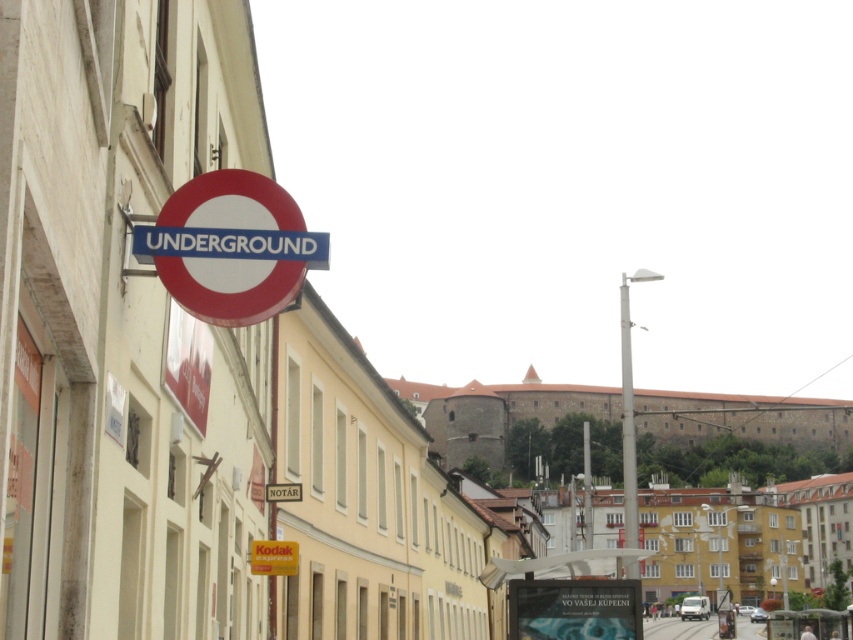
Does blue plastic underground sign at upper center appear on the right side of yellow matte kodak express sign at lower center?

Yes, blue plastic underground sign at upper center is to the right of yellow matte kodak express sign at lower center.

Does point (136, 241) come farther from viewer compared to point (250, 563)?

No, (136, 241) is in front of (250, 563).

Is point (137, 241) more distant than point (270, 561)?

No.

Locate an element on the screen. Image resolution: width=853 pixels, height=640 pixels. blue plastic underground sign at upper center is located at coordinates (230, 243).

Is red circular sign at upper left above metallic silver bus stop at center?

Yes.

Between red circular sign at upper left and metallic silver bus stop at center, which one has less height?

Standing shorter between the two is red circular sign at upper left.

Is point (268, 236) positioned before point (637, 556)?

That is True.

Identify the location of red circular sign at upper left. The image size is (853, 640). (230, 248).

Is blue plastic underground sign at upper center thinner than white plastic sign at upper center?

In fact, blue plastic underground sign at upper center might be wider than white plastic sign at upper center.

Does blue plastic underground sign at upper center have a greater height compared to white plastic sign at upper center?

No.

Where is `blue plastic underground sign at upper center`? blue plastic underground sign at upper center is located at coordinates (230, 243).

You are a GUI agent. You are given a task and a screenshot of the screen. Output one action in this format:
    pyautogui.click(x=<x>, y=<y>)
    Task: Click on the blue plastic underground sign at upper center
    
    Given the screenshot: What is the action you would take?
    pyautogui.click(x=230, y=243)